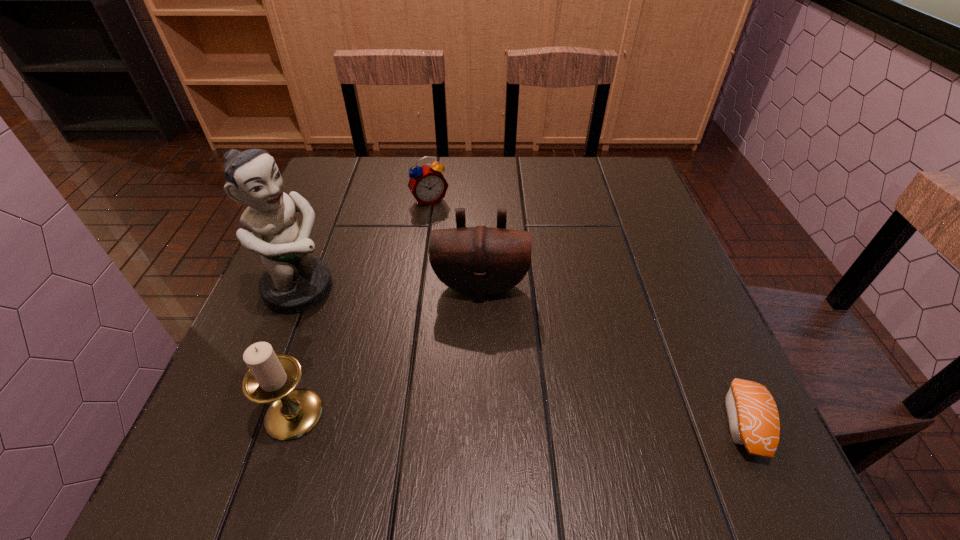
At what (x,y) coordinates should I click in order to perform the action: click on sushi positioned at the near edge. Please return your answer as a coordinate pair (x, y). The width and height of the screenshot is (960, 540). Looking at the image, I should click on (752, 414).

You are a GUI agent. You are given a task and a screenshot of the screen. Output one action in this format:
    pyautogui.click(x=<x>, y=<y>)
    Task: Click on the candle holder positioned at the left edge
    The width and height of the screenshot is (960, 540).
    Given the screenshot: What is the action you would take?
    pyautogui.click(x=272, y=378)

Locate an element on the screen. This screenshot has height=540, width=960. figurine positioned at the left edge is located at coordinates (294, 282).

You are a GUI agent. You are given a task and a screenshot of the screen. Output one action in this format:
    pyautogui.click(x=<x>, y=<y>)
    Task: Click on the object present at the right edge
    This screenshot has width=960, height=540.
    Given the screenshot: What is the action you would take?
    pyautogui.click(x=752, y=414)

Find the location of a particular element. This screenshot has height=540, width=960. object at the near left corner is located at coordinates (272, 378).

Locate an element on the screen. object positioned at the near right corner is located at coordinates (752, 414).

This screenshot has width=960, height=540. I want to click on vacant region at the far edge of the desktop, so click(x=495, y=169).

Locate an element on the screen. free space at the near edge of the desktop is located at coordinates (605, 416).

The height and width of the screenshot is (540, 960). In the image, there is a desktop. Find the location of `vacant space at the left edge`. vacant space at the left edge is located at coordinates (324, 332).

In the image, there is a desktop. What are the coordinates of `vacant region at the right edge` in the screenshot? It's located at (668, 303).